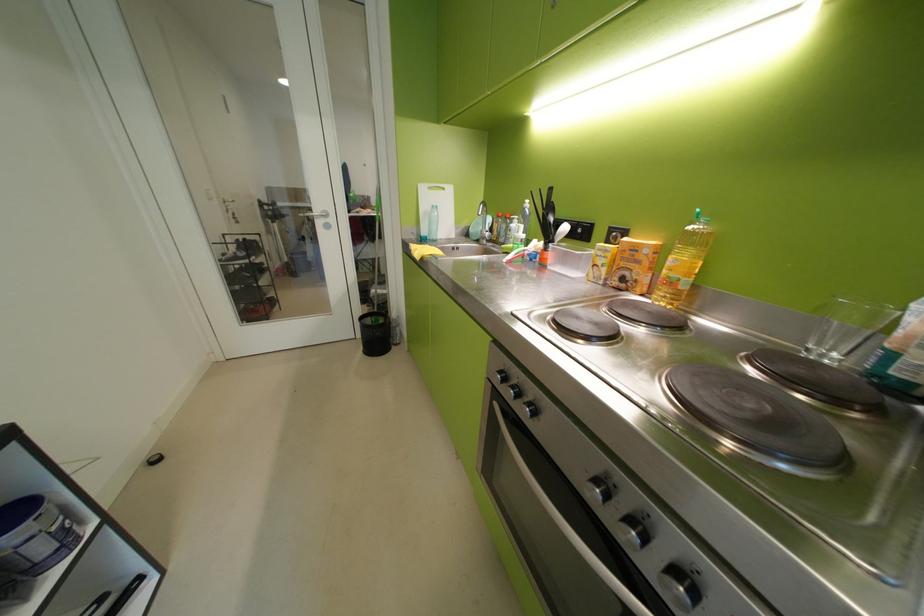
This screenshot has width=924, height=616. I want to click on black trash can, so click(x=374, y=333).